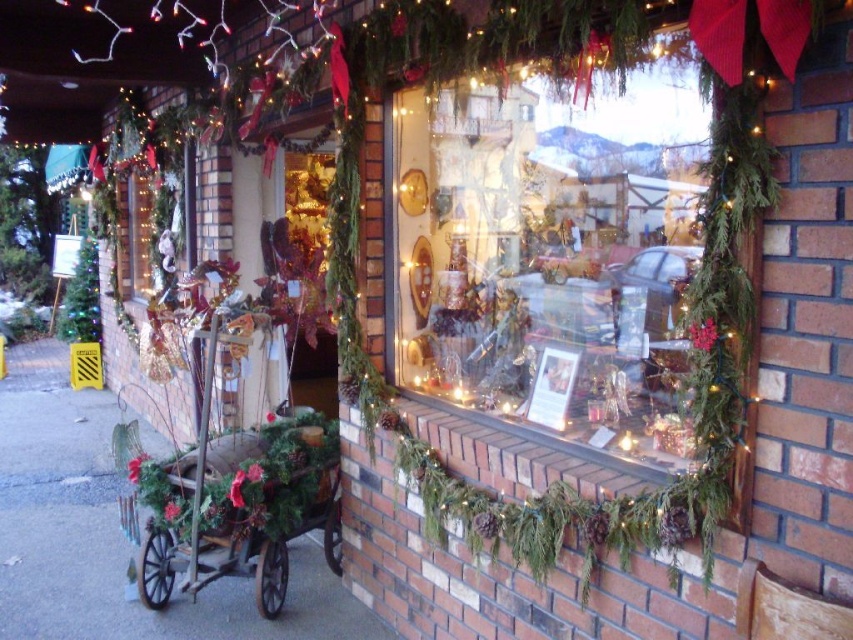
You are a delivery person standing in front of the festive storefront. You need to place a small package on the matte glass window at center. Can you reach it without any assistance?

The matte glass window at center is 1.61 meters away from the camera. Since the average person can reach up to about 2 meters, you can reach it without assistance.

You are a delivery person trying to deliver a package to the store. The package is too large to fit through the door, so you need to use the window. However, you need to know if the package will fit through the window. The package is the same size as the wooden rustic wagon at center. Will the package fit through the matte glass window at center?

The matte glass window at center has a larger size compared to wooden rustic wagon at center, so the package, which is the same size as the wooden rustic wagon at center, will fit through the matte glass window at center.

You are a delivery person trying to unload a box that is 40 inches wide. You see the matte glass window at center and the wooden rustic wagon at center. Can you fit the box between them without bending it?

The distance between the matte glass window at center and the wooden rustic wagon at center is 38.73 inches. Since the box is 40 inches wide, it cannot fit between them without bending.